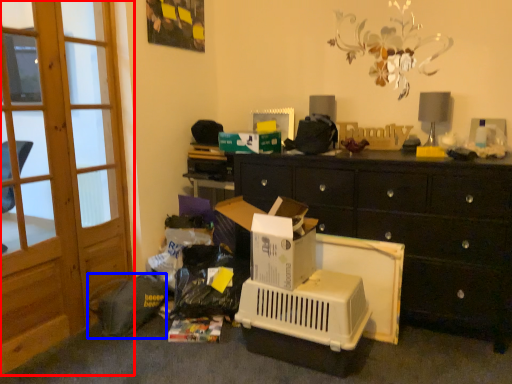
Question: Which object appears closest to the camera in this image, screen door (highlighted by a red box) or garbage (highlighted by a blue box)?

Choices:
 (A) screen door
 (B) garbage

Answer: (A)